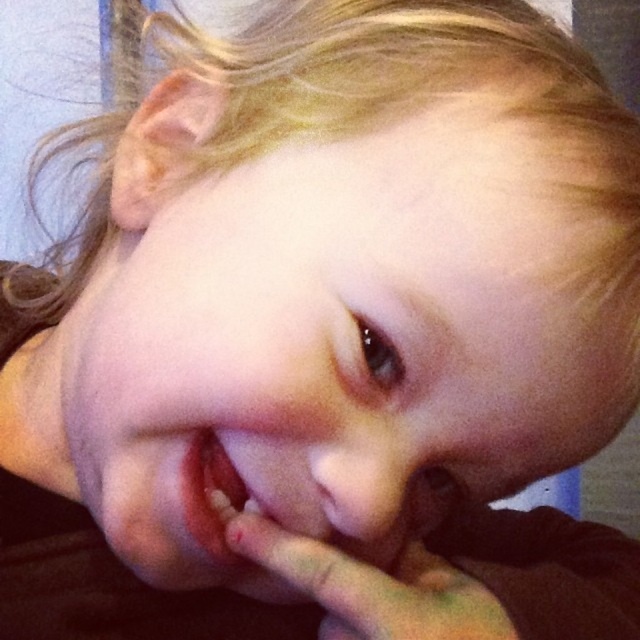
You are a photographer trying to capture a closeup of a child. You want to ensure the focus is on the child while keeping the background slightly blurred. Given that the camera is positioned at a certain distance from the point at point (355, 477), what is the minimum distance you should maintain between the camera and the subject to achieve this effect?

The minimum distance should be at least 12.54 inches to maintain focus on the child at point (355, 477) while keeping the background blurred.

Based on the scene description, can you determine which object is located above the other between the smooth skin face at center and the smooth skin hand at lower center?

The smooth skin face at center is positioned over smooth skin hand at lower center, so the smooth skin face at center is above the smooth skin hand at lower center.

In the image, there is a point labeled at coordinates point [371,586]. Based on the scene description, where is this point located?

The point [371,586] is located on the smooth skin hand at lower center.